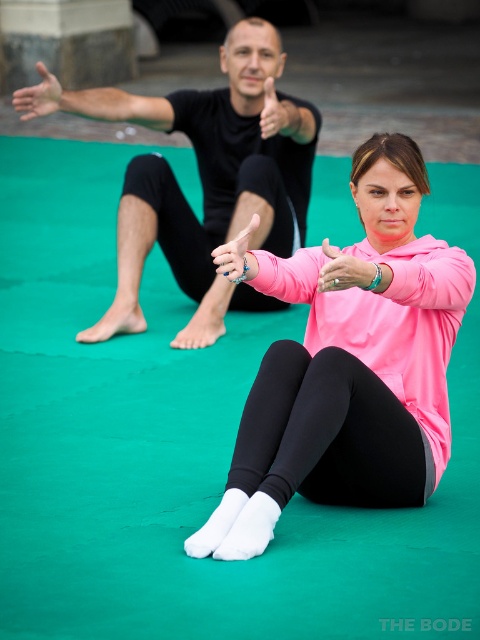
Which is in front, point (334, 280) or point (232, 276)?

Point (334, 280) is in front.

Is pink matte wristband at center thinner than silver metallic ring at center?

Incorrect, pink matte wristband at center's width is not less than silver metallic ring at center's.

Does point (340, 276) lie in front of point (229, 276)?

That is True.

The width and height of the screenshot is (480, 640). In order to click on pink matte wristband at center in this screenshot , I will do `click(344, 269)`.

Measure the distance between black matte/black leggings at upper center and matte black hand at upper center.

black matte/black leggings at upper center is 1.44 meters away from matte black hand at upper center.

Is black matte/black leggings at upper center positioned in front of matte black hand at upper center?

That is False.

What do you see at coordinates (231, 124) in the screenshot?
I see `black matte/black leggings at upper center` at bounding box center [231, 124].

The height and width of the screenshot is (640, 480). In order to click on black matte/black leggings at upper center in this screenshot , I will do `click(231, 124)`.

Does point (376, 273) come closer to viewer compared to point (338, 259)?

No, (376, 273) is behind (338, 259).

Who is more forward, (420, 298) or (338, 282)?

Point (338, 282)

Where is `pink matte hoodie at center`? The width and height of the screenshot is (480, 640). pink matte hoodie at center is located at coordinates (350, 369).